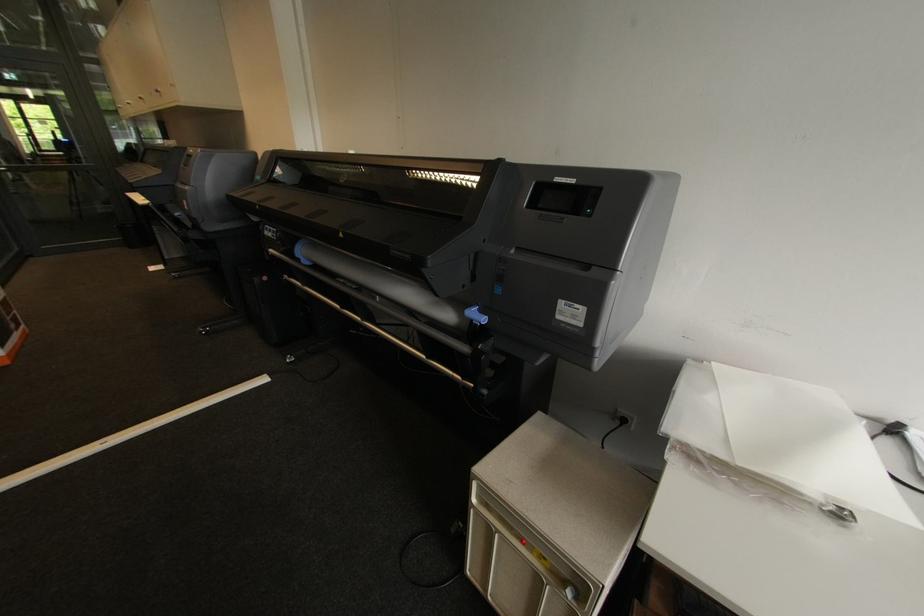
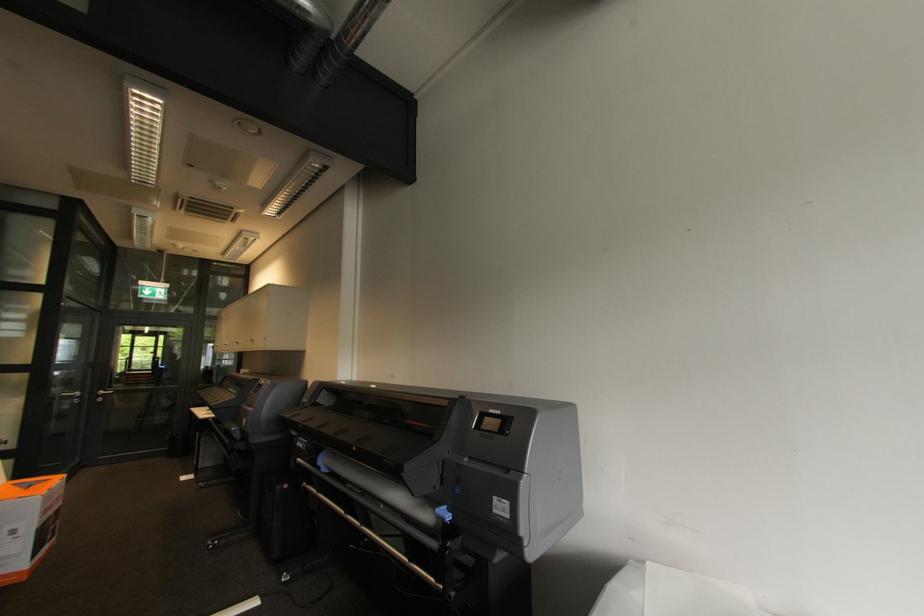
Question: The first image is from the beginning of the video and the second image is from the end. How did the camera likely rotate when shooting the video?

Choices:
 (A) Left
 (B) Right
 (C) Up
 (D) Down

Answer: (C)